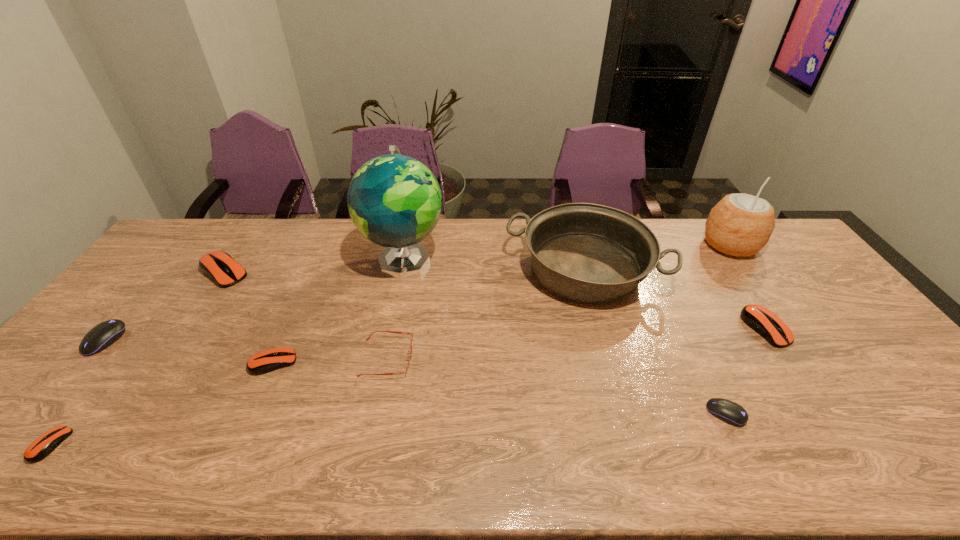
Identify the location of vacant area situated on the back of the third orange computer mouse from right to left. The width and height of the screenshot is (960, 540). (241, 247).

Identify the location of vacant space situated 0.310m on the left of the rightmost orange computer mouse. (637, 328).

You are a GUI agent. You are given a task and a screenshot of the screen. Output one action in this format:
    pyautogui.click(x=<x>, y=<y>)
    Task: Click on the vacant region located on the back of the leftmost object
    
    Given the screenshot: What is the action you would take?
    pyautogui.click(x=136, y=303)

Locate an element on the screen. The image size is (960, 540). free space located 0.220m on the lenses of the pink spectacles is located at coordinates (496, 357).

Identify the location of free spot located 0.190m on the back of the fourth object from left to right. (300, 301).

Identify the location of vacant area situated 0.200m on the left of the fifth computer mouse from left to right. This screenshot has width=960, height=540. (624, 414).

Identify the location of vacant space located 0.090m on the back of the nearest orange computer mouse. (90, 393).

Image resolution: width=960 pixels, height=540 pixels. I want to click on globe that is at the far edge, so click(395, 201).

Locate an element on the screen. Image resolution: width=960 pixels, height=540 pixels. coconut positioned at the far edge is located at coordinates (740, 225).

The width and height of the screenshot is (960, 540). What are the coordinates of `pan that is at the far edge` in the screenshot? It's located at (591, 253).